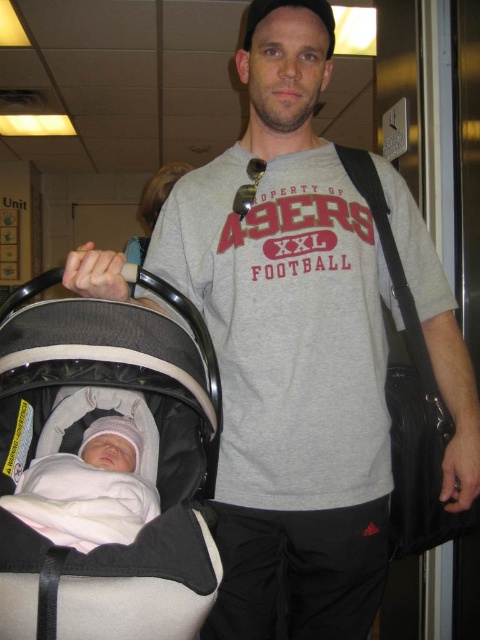
You are a designer trying to create a new product that combines both the beige fabric baby carriage at center and the soft pink fabric at center. Which material should you use as the base for your design if you want the base to be larger in size?

The beige fabric baby carriage at center is bigger than the soft pink fabric at center, so you should use the beige fabric baby carriage at center as the base for your design to ensure it is larger in size.

You are a security guard in the building and need to check the items in front of you. You see the beige fabric baby carriage at center and the soft pink fabric at center. Which object is closer to you?

The beige fabric baby carriage at center is closer to you because it is in front of the soft pink fabric at center.

You are a photographer trying to capture the man and the baby in the stroller. You need to ensure both the beige fabric baby carriage at center and the soft pink fabric at center are visible in the frame. Based on their positions, which object should you focus on first to include both in the shot?

The beige fabric baby carriage at center is positioned on the right side of the soft pink fabric at center. To include both in the frame, focus on the soft pink fabric at center first as it is on the left, allowing the carriage to naturally fall into the right side of the shot.